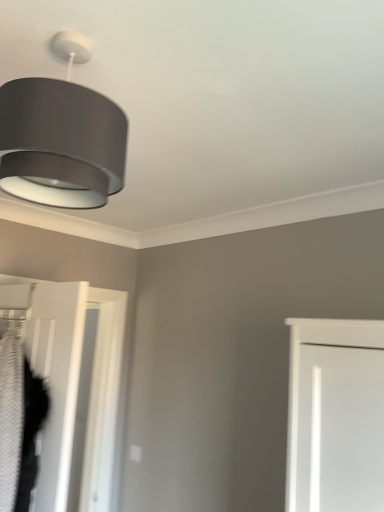
Question: Is white textured door at lower left bigger or smaller than matte gray lampshade at upper left?

Choices:
 (A) big
 (B) small

Answer: (A)

Question: Considering the positions of white textured door at lower left and matte gray lampshade at upper left in the image, is white textured door at lower left wider or thinner than matte gray lampshade at upper left?

Choices:
 (A) wide
 (B) thin

Answer: (B)

Question: From the image's perspective, is white textured door at lower left above or below matte gray lampshade at upper left?

Choices:
 (A) below
 (B) above

Answer: (A)

Question: In terms of size, does matte gray lampshade at upper left appear bigger or smaller than white textured door at lower left?

Choices:
 (A) small
 (B) big

Answer: (A)

Question: Looking at their shapes, would you say matte gray lampshade at upper left is wider or thinner than white textured door at lower left?

Choices:
 (A) thin
 (B) wide

Answer: (B)

Question: Is matte gray lampshade at upper left inside the boundaries of white textured door at lower left, or outside?

Choices:
 (A) inside
 (B) outside

Answer: (B)

Question: Is matte gray lampshade at upper left taller or shorter than white textured door at lower left?

Choices:
 (A) tall
 (B) short

Answer: (B)